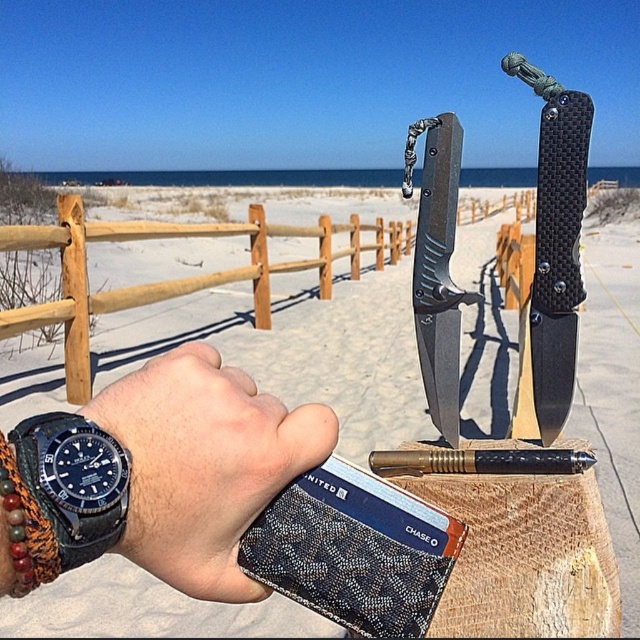
Between black textured knife at upper center and black carbon fiber knife at center, which one appears on the right side from the viewer's perspective?

black carbon fiber knife at center

Can you confirm if black textured knife at upper center is positioned above black carbon fiber knife at center?

Yes.

Is point (627, 364) positioned before point (550, 164)?

No, (627, 364) is further to viewer.

You are a GUI agent. You are given a task and a screenshot of the screen. Output one action in this format:
    pyautogui.click(x=<x>, y=<y>)
    Task: Click on the black textured knife at upper center
    The width and height of the screenshot is (640, 640).
    Given the screenshot: What is the action you would take?
    pyautogui.click(x=298, y=348)

Who is more distant from viewer, (216, 595) or (35, 548)?

Positioned behind is point (216, 595).

What do you see at coordinates (204, 465) in the screenshot?
I see `black leather watch at lower left` at bounding box center [204, 465].

From the picture: Who is more distant from viewer, [228,368] or [83,552]?

The point [228,368] is behind.

Identify the location of black leather watch at lower left. tap(204, 465).

Can you confirm if black textured knife at upper center is positioned above black leather watch at lower left?

Yes, black textured knife at upper center is above black leather watch at lower left.

Between black textured knife at upper center and black leather watch at lower left, which one is positioned lower?

black leather watch at lower left is below.

Which is behind, point (596, 346) or point (310, 417)?

Point (596, 346)

Identify the location of black textured knife at upper center. (298, 348).